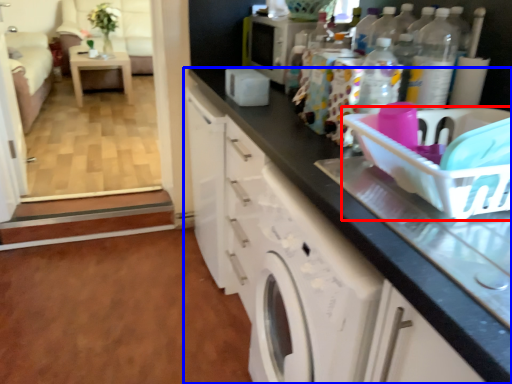
Question: Which object is further to the camera taking this photo, basket (highlighted by a red box) or cabinetry (highlighted by a blue box)?

Choices:
 (A) basket
 (B) cabinetry

Answer: (A)